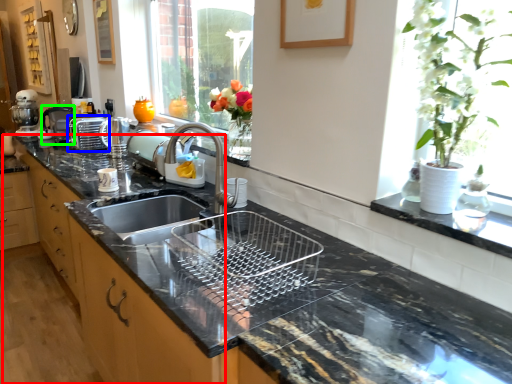
Question: Estimate the real-world distances between objects in this image. Which object is closer to cabinetry (highlighted by a red box), appliance (highlighted by a blue box) or coffee machine (highlighted by a green box)?

Choices:
 (A) appliance
 (B) coffee machine

Answer: (A)